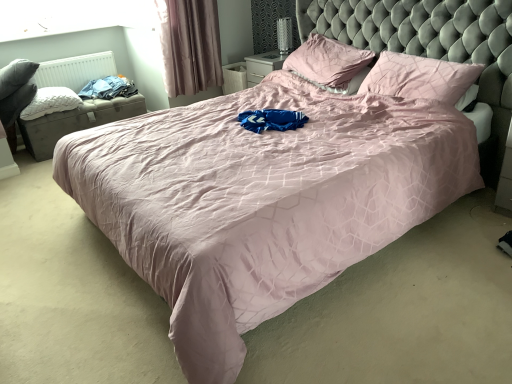
Find the location of a particular element. This screenshot has width=512, height=384. vacant space in between blue cotton clothes at left and white quilted pillow at left, arranged as the 1th pillow when viewed from the left is located at coordinates (102, 104).